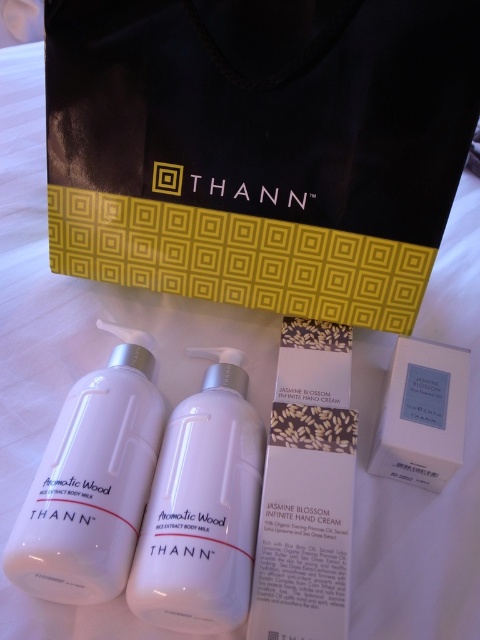
Is white matte bottle at center positioned in front of white matte box at center?

Yes, it is in front of white matte box at center.

Who is more forward, (x=127, y=460) or (x=407, y=342)?

Point (x=127, y=460)

Who is more forward, [112,403] or [421,422]?

Point [112,403]

Identify the location of white matte bottle at center. The width and height of the screenshot is (480, 640). (92, 481).

Who is shorter, black matte bag at upper center or white matte box at center?

Standing shorter between the two is white matte box at center.

Does point (278, 45) come behind point (455, 456)?

Yes, point (278, 45) is farther from viewer.

Is point (92, 268) positioned in front of point (432, 380)?

That is False.

Locate an element on the screen. This screenshot has height=640, width=480. black matte bag at upper center is located at coordinates (260, 147).

Between point (98, 234) and point (182, 445), which one is positioned in front?

Point (182, 445) is in front.

Who is shorter, black matte bag at upper center or white glossy bottle at center?

white glossy bottle at center

The image size is (480, 640). Describe the element at coordinates (260, 147) in the screenshot. I see `black matte bag at upper center` at that location.

I want to click on black matte bag at upper center, so click(260, 147).